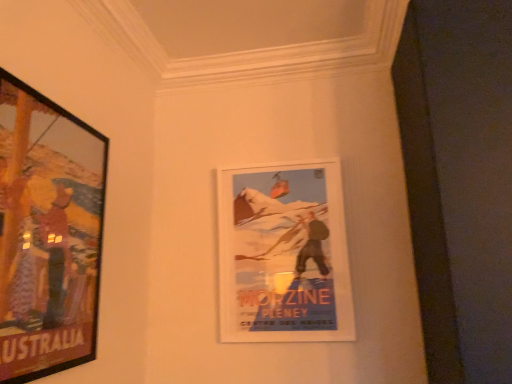
Where is `wooden-framed poster at left, the 2th picture frame when ordered from right to left`? Image resolution: width=512 pixels, height=384 pixels. wooden-framed poster at left, the 2th picture frame when ordered from right to left is located at coordinates (47, 234).

What do you see at coordinates (47, 234) in the screenshot? I see `wooden-framed poster at left, the first picture frame positioned from the left` at bounding box center [47, 234].

Measure the distance between point (92,281) and camera.

A distance of 1.35 meters exists between point (92,281) and camera.

Find the location of `white paper poster at center, which ranks as the first picture frame in back-to-front order`. white paper poster at center, which ranks as the first picture frame in back-to-front order is located at coordinates (283, 254).

Describe the element at coordinates (283, 254) in the screenshot. This screenshot has width=512, height=384. I see `white paper poster at center, which ranks as the first picture frame in back-to-front order` at that location.

The height and width of the screenshot is (384, 512). I want to click on wooden-framed poster at left, the first picture frame in the front-to-back sequence, so click(x=47, y=234).

Which object is positioned more to the left, white paper poster at center, arranged as the 2th picture frame when viewed from the front, or wooden-framed poster at left, the 2th picture frame when ordered from right to left?

wooden-framed poster at left, the 2th picture frame when ordered from right to left, is more to the left.

Between white paper poster at center, positioned as the second picture frame in left-to-right order, and wooden-framed poster at left, the 2th picture frame when ordered from right to left, which one is positioned behind?

white paper poster at center, positioned as the second picture frame in left-to-right order, is more distant.

Which is farther from the camera, (234, 311) or (71, 348)?

The point (234, 311) is farther.

From the image's perspective, is white paper poster at center, arranged as the 2th picture frame when viewed from the front, under wooden-framed poster at left, the 2th picture frame when ordered from right to left?

Correct, white paper poster at center, arranged as the 2th picture frame when viewed from the front, appears lower than wooden-framed poster at left, the 2th picture frame when ordered from right to left, in the image.

From a real-world perspective, who is located lower, white paper poster at center, positioned as the second picture frame in left-to-right order, or wooden-framed poster at left, the first picture frame positioned from the left?

white paper poster at center, positioned as the second picture frame in left-to-right order.

Is white paper poster at center, which ranks as the first picture frame in back-to-front order, wider or thinner than wooden-framed poster at left, the 2th picture frame when ordered from right to left?

Clearly, white paper poster at center, which ranks as the first picture frame in back-to-front order, has less width compared to wooden-framed poster at left, the 2th picture frame when ordered from right to left.

Between white paper poster at center, which appears as the 1th picture frame when viewed from the right, and wooden-framed poster at left, the first picture frame positioned from the left, which one has more height?

wooden-framed poster at left, the first picture frame positioned from the left.

Considering the sizes of white paper poster at center, arranged as the 2th picture frame when viewed from the front, and wooden-framed poster at left, the 2th picture frame when ordered from right to left, in the image, is white paper poster at center, arranged as the 2th picture frame when viewed from the front, bigger or smaller than wooden-framed poster at left, the 2th picture frame when ordered from right to left,?

Considering their sizes, white paper poster at center, arranged as the 2th picture frame when viewed from the front, takes up less space than wooden-framed poster at left, the 2th picture frame when ordered from right to left.

Would you say white paper poster at center, positioned as the second picture frame in left-to-right order, is inside or outside wooden-framed poster at left, the first picture frame positioned from the left?

white paper poster at center, positioned as the second picture frame in left-to-right order, is not enclosed by wooden-framed poster at left, the first picture frame positioned from the left.

Looking at this image, is white paper poster at center, which appears as the 1th picture frame when viewed from the right, touching wooden-framed poster at left, the 2th picture frame when ordered from right to left?

white paper poster at center, which appears as the 1th picture frame when viewed from the right, and wooden-framed poster at left, the 2th picture frame when ordered from right to left, are not in contact.

Is white paper poster at center, which ranks as the first picture frame in back-to-front order, oriented towards wooden-framed poster at left, the 2th picture frame when ordered from right to left?

No, white paper poster at center, which ranks as the first picture frame in back-to-front order, is not turned towards wooden-framed poster at left, the 2th picture frame when ordered from right to left.

You are a GUI agent. You are given a task and a screenshot of the screen. Output one action in this format:
    pyautogui.click(x=<x>, y=<y>)
    Task: Click on the picture frame lying behind the wooden-framed poster at left, the first picture frame in the front-to-back sequence
    This screenshot has height=384, width=512.
    Given the screenshot: What is the action you would take?
    pyautogui.click(x=283, y=254)

Which object is positioned more to the left, wooden-framed poster at left, the first picture frame positioned from the left, or white paper poster at center, positioned as the second picture frame in left-to-right order?

wooden-framed poster at left, the first picture frame positioned from the left.

Which is in front, wooden-framed poster at left, the first picture frame in the front-to-back sequence, or white paper poster at center, positioned as the second picture frame in left-to-right order?

wooden-framed poster at left, the first picture frame in the front-to-back sequence, is in front.

Is point (38, 271) less distant than point (271, 192)?

Yes, point (38, 271) is in front of point (271, 192).

From the image's perspective, which is below, wooden-framed poster at left, the first picture frame positioned from the left, or white paper poster at center, positioned as the second picture frame in left-to-right order?

white paper poster at center, positioned as the second picture frame in left-to-right order, from the image's perspective.

From a real-world perspective, is wooden-framed poster at left, positioned as the second picture frame in back-to-front order, on white paper poster at center, positioned as the second picture frame in left-to-right order?

Yes.

Is wooden-framed poster at left, the first picture frame in the front-to-back sequence, wider than white paper poster at center, which appears as the 1th picture frame when viewed from the right?

Indeed, wooden-framed poster at left, the first picture frame in the front-to-back sequence, has a greater width compared to white paper poster at center, which appears as the 1th picture frame when viewed from the right.

Between wooden-framed poster at left, the first picture frame in the front-to-back sequence, and white paper poster at center, which appears as the 1th picture frame when viewed from the right, which one has less height?

Standing shorter between the two is white paper poster at center, which appears as the 1th picture frame when viewed from the right.

Between wooden-framed poster at left, positioned as the second picture frame in back-to-front order, and white paper poster at center, which appears as the 1th picture frame when viewed from the right, which one has larger size?

Bigger between the two is wooden-framed poster at left, positioned as the second picture frame in back-to-front order.

Is wooden-framed poster at left, the first picture frame positioned from the left, positioned beyond the bounds of white paper poster at center, which appears as the 1th picture frame when viewed from the right?

Yes, wooden-framed poster at left, the first picture frame positioned from the left, is not within white paper poster at center, which appears as the 1th picture frame when viewed from the right.

Is wooden-framed poster at left, the 2th picture frame when ordered from right to left, placed right next to white paper poster at center, which appears as the 1th picture frame when viewed from the right?

No, wooden-framed poster at left, the 2th picture frame when ordered from right to left, is not beside white paper poster at center, which appears as the 1th picture frame when viewed from the right.

Is wooden-framed poster at left, the first picture frame positioned from the left, aimed at white paper poster at center, which appears as the 1th picture frame when viewed from the right?

No, wooden-framed poster at left, the first picture frame positioned from the left, is not aimed at white paper poster at center, which appears as the 1th picture frame when viewed from the right.

Locate an element on the screen. The image size is (512, 384). picture frame above the white paper poster at center, which appears as the 1th picture frame when viewed from the right (from a real-world perspective) is located at coordinates (47, 234).

At what (x,y) coordinates should I click in order to perform the action: click on picture frame above the white paper poster at center, which ranks as the first picture frame in back-to-front order (from the image's perspective). Please return your answer as a coordinate pair (x, y). The width and height of the screenshot is (512, 384). Looking at the image, I should click on (47, 234).

At what (x,y) coordinates should I click in order to perform the action: click on picture frame on the right side of wooden-framed poster at left, the 2th picture frame when ordered from right to left. Please return your answer as a coordinate pair (x, y). The width and height of the screenshot is (512, 384). Looking at the image, I should click on (283, 254).